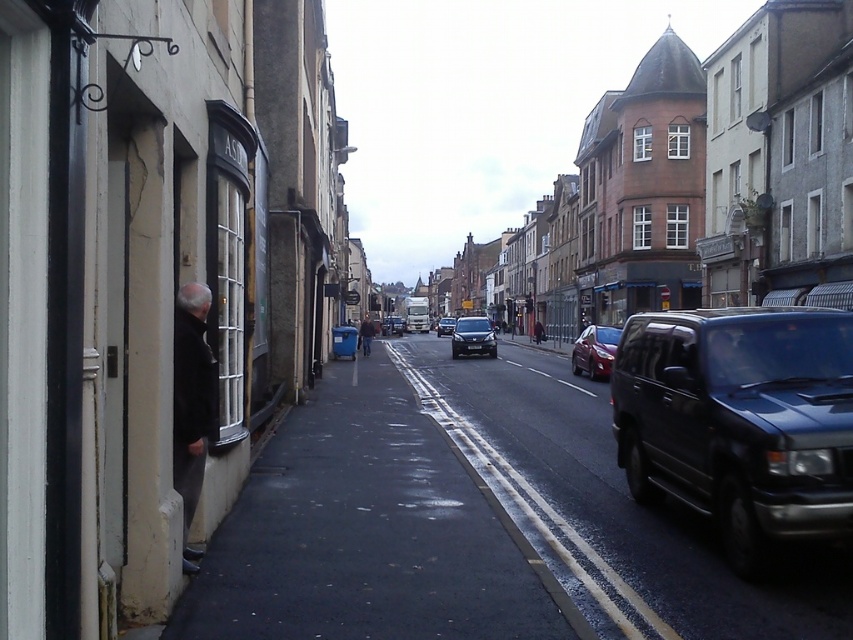
Does shiny silver sedan at center have a greater height compared to black plastic license plate at center?

Indeed, shiny silver sedan at center has a greater height compared to black plastic license plate at center.

Does point (476, 333) come closer to viewer compared to point (479, 349)?

No, it is behind (479, 349).

What do you see at coordinates (473, 337) in the screenshot? This screenshot has width=853, height=640. I see `shiny silver sedan at center` at bounding box center [473, 337].

Find the location of `shiny silver sedan at center`. shiny silver sedan at center is located at coordinates (473, 337).

Is metallic silver van at center bigger than black plastic license plate at center?

Yes, metallic silver van at center is bigger than black plastic license plate at center.

Where is `metallic silver van at center`? The image size is (853, 640). metallic silver van at center is located at coordinates (392, 324).

Can you confirm if dark gray concrete sidewalk at lower left is positioned to the right of matte black car at center?

No, dark gray concrete sidewalk at lower left is not to the right of matte black car at center.

Between point (409, 476) and point (450, 332), which one is positioned in front?

Positioned in front is point (409, 476).

From the picture: Who is more distant from viewer, (320, 467) or (445, 323)?

The point (445, 323) is more distant.

The height and width of the screenshot is (640, 853). In order to click on dark gray concrete sidewalk at lower left in this screenshot , I will do `click(369, 534)`.